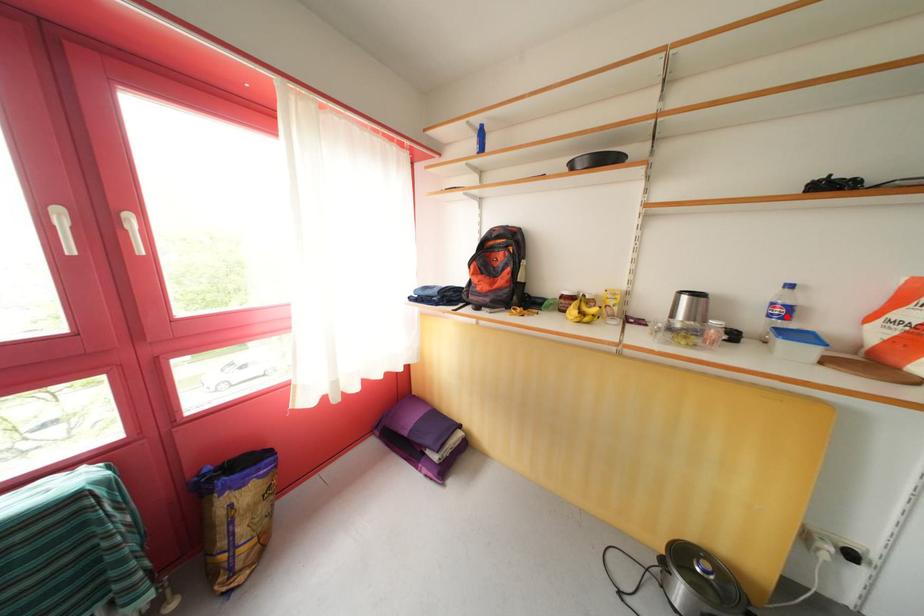
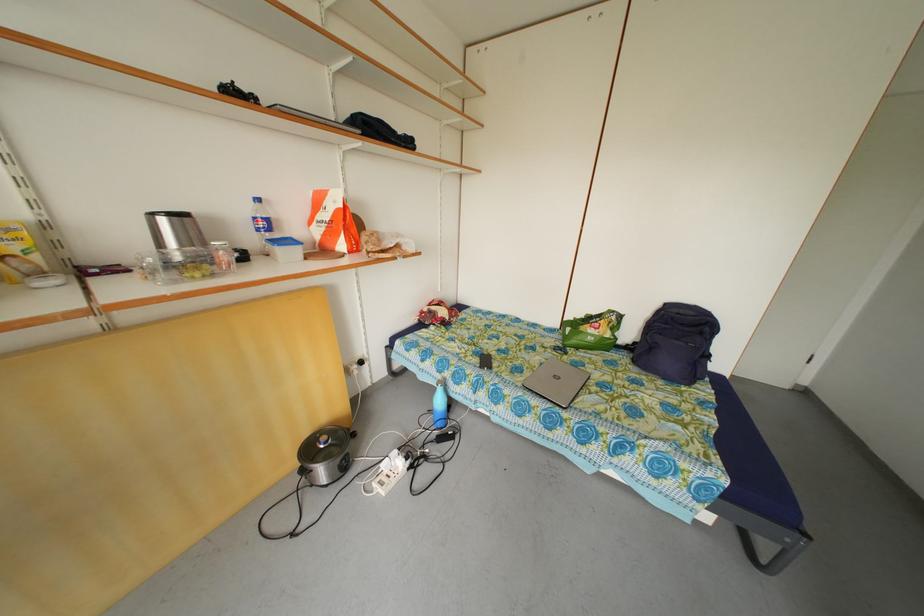
Where in the second image is the point corresponding to the highlighted location from the first image?

(270, 230)